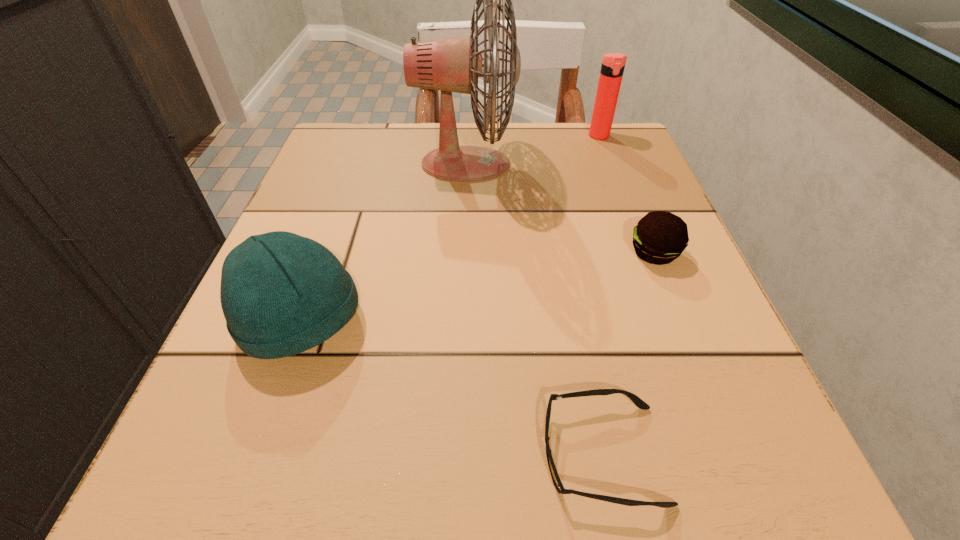
Find the location of `object identified as the third closest to the tallest object`. object identified as the third closest to the tallest object is located at coordinates (281, 294).

You are a GUI agent. You are given a task and a screenshot of the screen. Output one action in this format:
    pyautogui.click(x=<x>, y=<y>)
    Task: Click on the object that is the closest one to the nearest object
    
    Given the screenshot: What is the action you would take?
    [x=660, y=237]

Where is `vacant space that satisfies the following two spatial constraints: 1. in front of the tallest object to direct airflow; 2. on the back side of the patty`? The image size is (960, 540). vacant space that satisfies the following two spatial constraints: 1. in front of the tallest object to direct airflow; 2. on the back side of the patty is located at coordinates (463, 253).

You are a GUI agent. You are given a task and a screenshot of the screen. Output one action in this format:
    pyautogui.click(x=<x>, y=<y>)
    Task: Click on the free point that satisfies the following two spatial constraints: 1. on the back side of the beanie; 2. on the right side of the thermos bottle
    
    Given the screenshot: What is the action you would take?
    pyautogui.click(x=368, y=136)